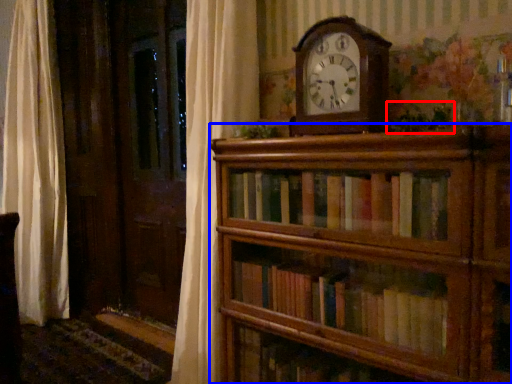
Question: Which point is closer to the camera, plant (highlighted by a red box) or shelf (highlighted by a blue box)?

Choices:
 (A) plant
 (B) shelf

Answer: (B)